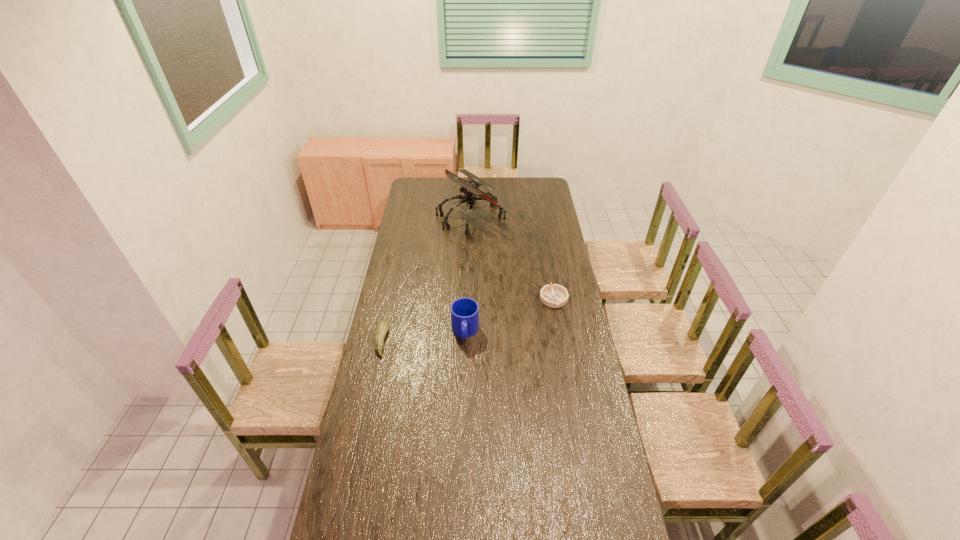
The height and width of the screenshot is (540, 960). What are the coordinates of `vacant area that lies between the mug and the rightmost object` in the screenshot? It's located at (510, 315).

Find the location of a particular element. Image resolution: width=960 pixels, height=540 pixels. blank region between the tallest object and the mug is located at coordinates (468, 274).

Image resolution: width=960 pixels, height=540 pixels. What are the coordinates of `free space between the tallest object and the zucchini` in the screenshot? It's located at (426, 279).

Locate an element on the screen. Image resolution: width=960 pixels, height=540 pixels. free spot between the second tallest object and the ashtray is located at coordinates (510, 315).

Find the location of a particular element. the second closest object to the second tallest object is located at coordinates (555, 296).

In order to click on object that is the closest to the second tallest object in this screenshot , I will do `click(382, 327)`.

Locate an element on the screen. Image resolution: width=960 pixels, height=540 pixels. free spot that satisfies the following two spatial constraints: 1. on the side with the handle of the second tallest object; 2. at the stem end of the third tallest object is located at coordinates click(x=465, y=341).

Where is `vacant area that satisfies the following two spatial constraints: 1. on the side with the handle of the mug; 2. at the stem end of the leftmost object`? vacant area that satisfies the following two spatial constraints: 1. on the side with the handle of the mug; 2. at the stem end of the leftmost object is located at coordinates (465, 341).

Identify the location of vacant area that satisfies the following two spatial constraints: 1. on the side with the handle of the second tallest object; 2. at the stem end of the zucchini. [x=465, y=341].